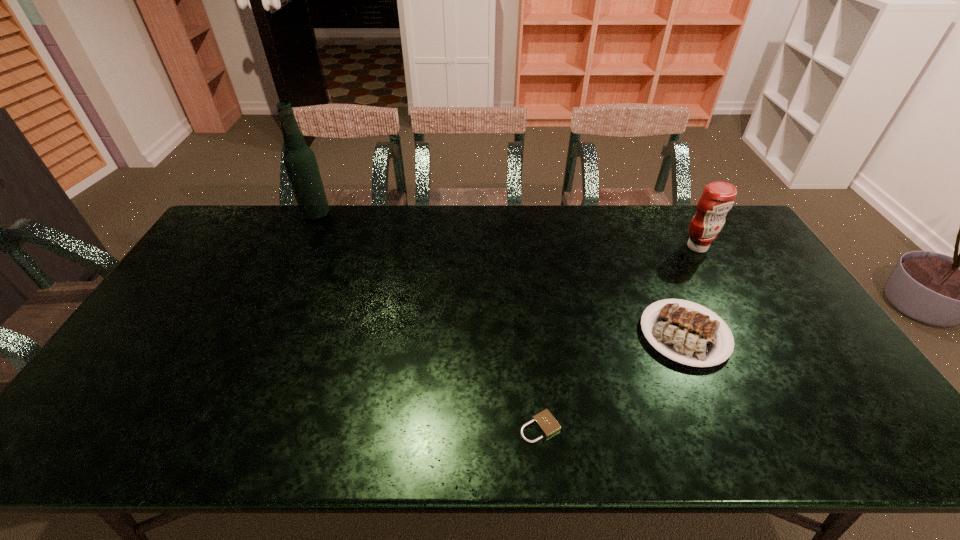
What are the coordinates of `free location located 0.300m on the left of the second nearest object` in the screenshot? It's located at (527, 334).

The image size is (960, 540). In order to click on vacant position located on the left of the shortest object in this screenshot , I will do 425,427.

At what (x,y) coordinates should I click in order to perform the action: click on alcohol present at the far edge. Please return your answer as a coordinate pair (x, y). The image size is (960, 540). Looking at the image, I should click on (300, 162).

Locate an element on the screen. This screenshot has width=960, height=540. condiment present at the far edge is located at coordinates (717, 199).

Locate an element on the screen. The height and width of the screenshot is (540, 960). object at the near edge is located at coordinates (545, 421).

Image resolution: width=960 pixels, height=540 pixels. In order to click on object located in the right edge section of the desktop in this screenshot , I will do `click(717, 199)`.

You are a GUI agent. You are given a task and a screenshot of the screen. Output one action in this format:
    pyautogui.click(x=<x>, y=<y>)
    Task: Click on the object located in the far right corner section of the desktop
    The height and width of the screenshot is (540, 960).
    Given the screenshot: What is the action you would take?
    pyautogui.click(x=717, y=199)

Identify the location of vacant area at the far edge. (610, 214).

Identify the location of free space at the near edge. The width and height of the screenshot is (960, 540). (701, 425).

Locate an element on the screen. Image resolution: width=960 pixels, height=540 pixels. free spot at the left edge of the desktop is located at coordinates (115, 416).